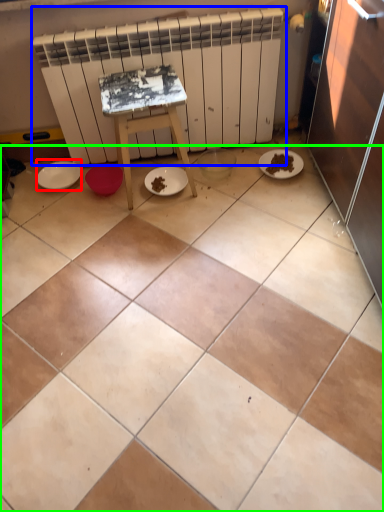
Question: Considering the real-world distances, which object is closest to paper plate (highlighted by a red box)? radiator (highlighted by a blue box) or ceramic tile (highlighted by a green box).

Choices:
 (A) radiator
 (B) ceramic tile

Answer: (A)